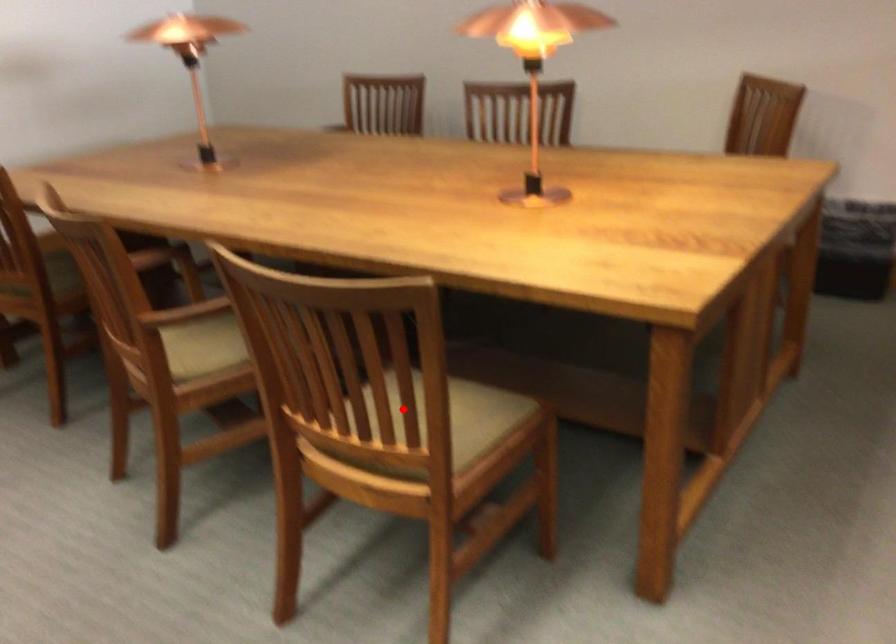
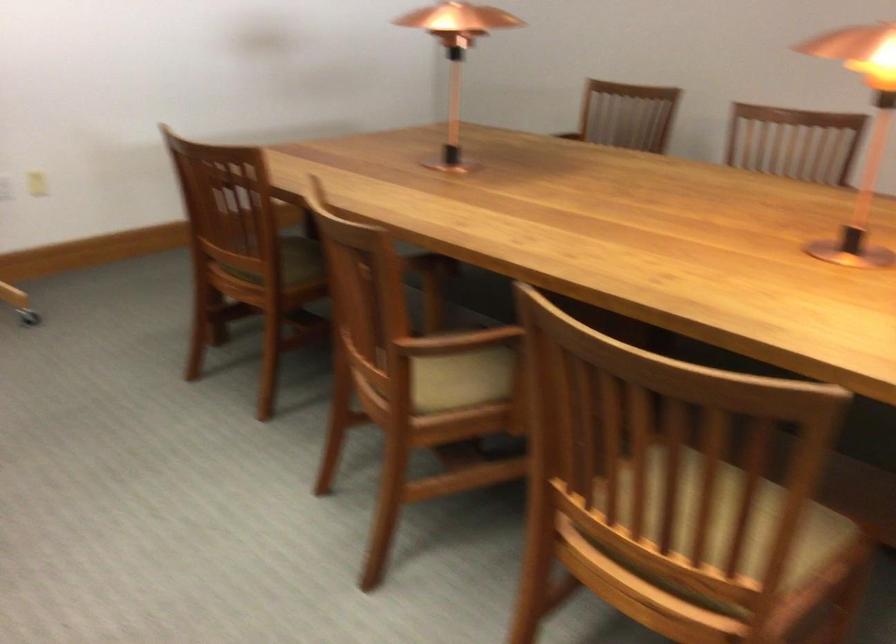
In the second image, find the point that corresponds to the highlighted location in the first image.

(728, 526)